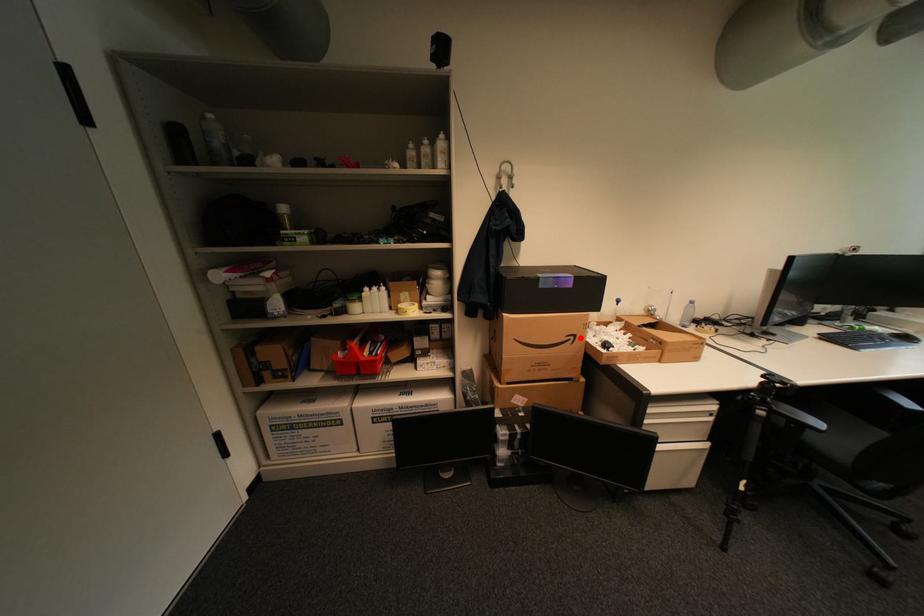
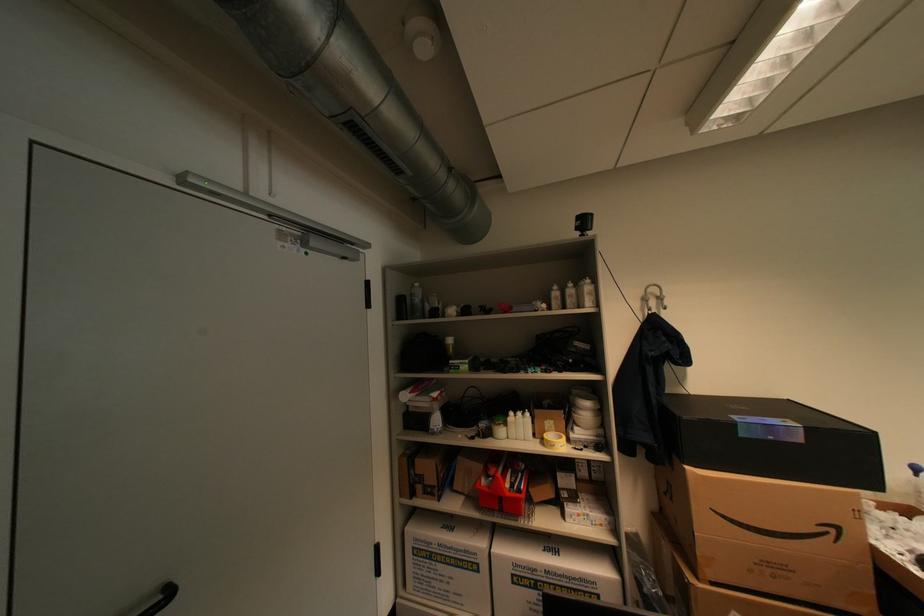
Find the pixel in the second image that matches the highlighted location in the first image.

(841, 531)